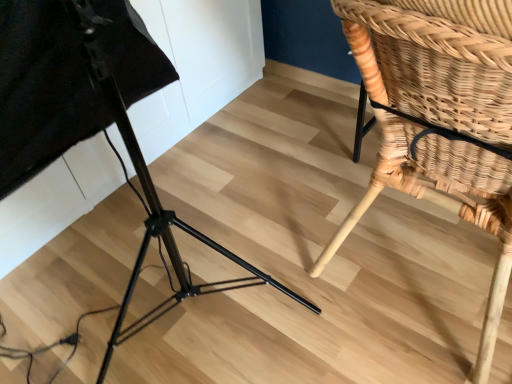
You are a GUI agent. You are given a task and a screenshot of the screen. Output one action in this format:
    pyautogui.click(x=<x>, y=<y>)
    Task: Click on the vacant space behind woven wood chair at lower right
    This screenshot has width=512, height=384.
    Given the screenshot: What is the action you would take?
    pyautogui.click(x=307, y=145)